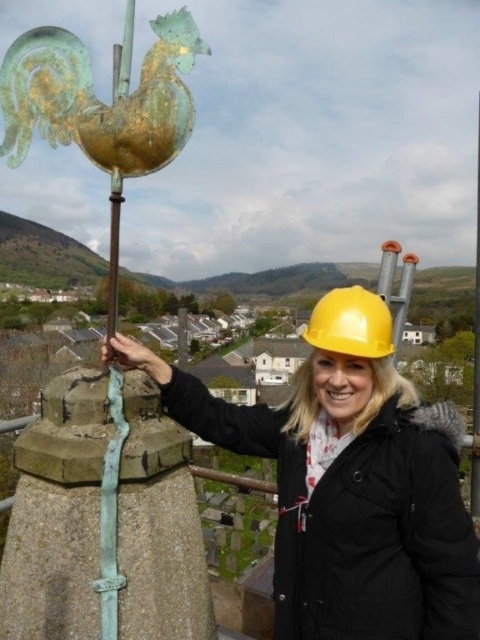
Question: Which object is closer to the camera taking this photo?

Choices:
 (A) green patina rooster at upper left
 (B) yellow hard hat at upper center

Answer: (A)

Question: Is yellow hard hat at upper center wider than yellow matte hard hat at center?

Choices:
 (A) yes
 (B) no

Answer: (A)

Question: Does green patina rooster at upper left have a lesser width compared to yellow matte hard hat at center?

Choices:
 (A) no
 (B) yes

Answer: (A)

Question: Is green patina rooster at upper left behind yellow matte hard hat at center?

Choices:
 (A) no
 (B) yes

Answer: (A)

Question: Which point is closer to the camera?

Choices:
 (A) (399, 464)
 (B) (168, 67)
 (C) (361, 305)

Answer: (B)

Question: Which of the following is the closest to the observer?

Choices:
 (A) (364, 577)
 (B) (339, 291)

Answer: (A)